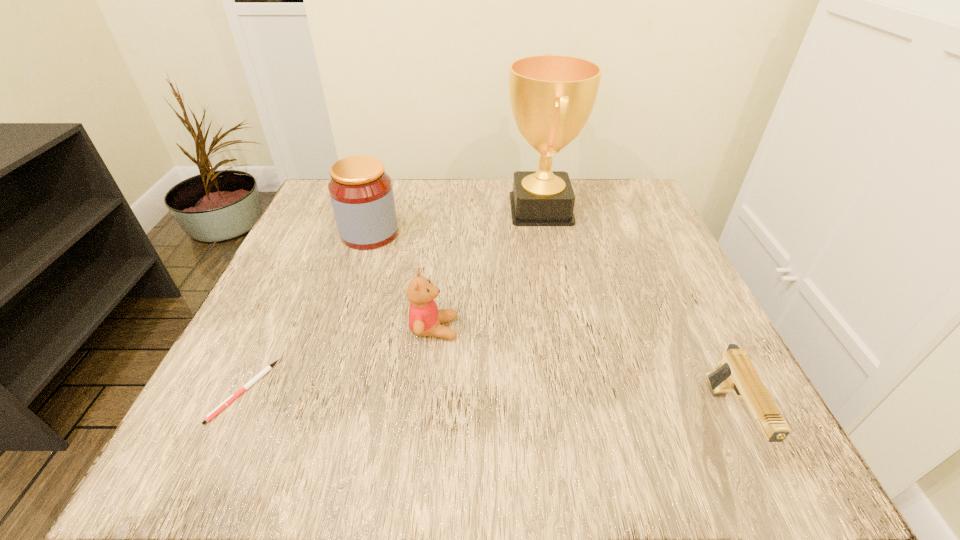
Find the location of a particular element. The width and height of the screenshot is (960, 540). free area in between the jar and the pen is located at coordinates (307, 312).

Where is `object that is the closest to the second tallest object`? This screenshot has height=540, width=960. object that is the closest to the second tallest object is located at coordinates (425, 319).

Find the location of `object that can be found as the fourth closest to the second tallest object`. object that can be found as the fourth closest to the second tallest object is located at coordinates (736, 373).

Locate an element on the screen. The image size is (960, 540). free spot that satisfies the following two spatial constraints: 1. on the front-facing side of the award; 2. on the front side of the jar is located at coordinates (545, 233).